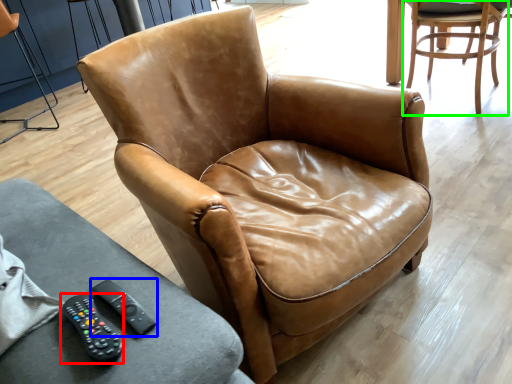
Question: Which object is the farthest from remote (highlighted by a red box)? Choose among these: remote (highlighted by a blue box) or chair (highlighted by a green box).

Choices:
 (A) remote
 (B) chair

Answer: (B)